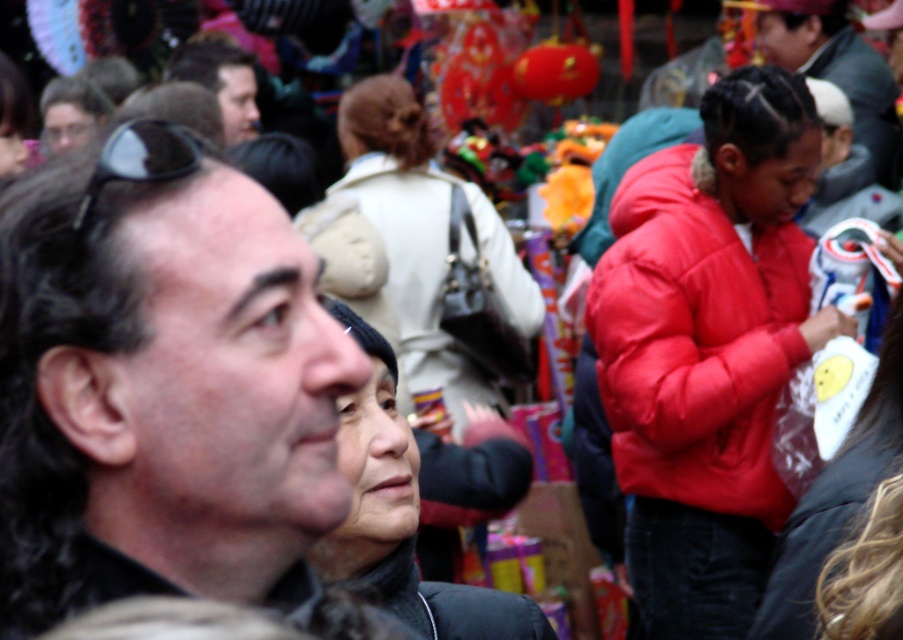
You are a photographer trying to capture a candid shot of the matte red jacket at right and the black matte sunglasses at upper left in the crowded market scene. Since you want both subjects to be fully visible in the frame, which object should you focus on first to ensure it doesn t get cropped out?

The matte red jacket at right is taller than the black matte sunglasses at upper left, so you should focus on framing the matte red jacket at right first to ensure it fits entirely within the shot before adjusting for the smaller black matte sunglasses at upper left.